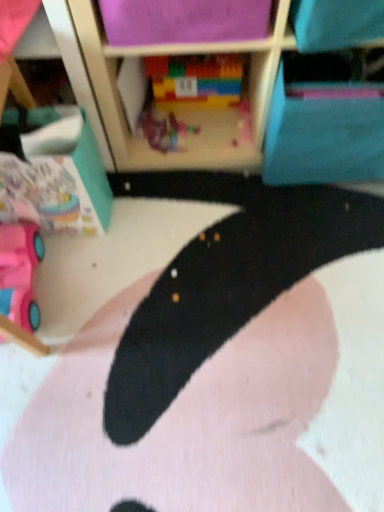
At what (x,y) coordinates should I click in order to perform the action: click on space that is in front of blue fabric cabinet at upper right. Please return your answer as a coordinate pair (x, y). Looking at the image, I should click on (321, 227).